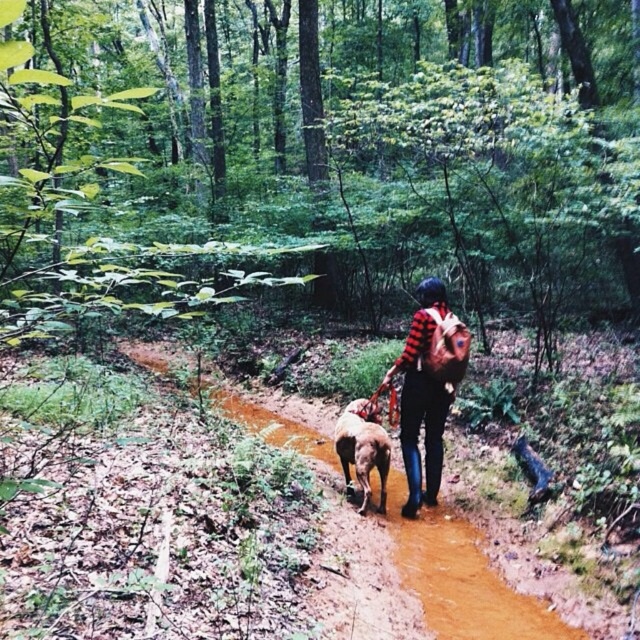
Question: Does brown dirt trail at center appear over brown furry dog at center?

Choices:
 (A) no
 (B) yes

Answer: (A)

Question: Is brown dirt trail at center closer to the viewer compared to plaid shirt at center?

Choices:
 (A) no
 (B) yes

Answer: (B)

Question: Is brown dirt trail at center further to the viewer compared to plaid shirt at center?

Choices:
 (A) yes
 (B) no

Answer: (B)

Question: Which point appears closest to the camera in this image?

Choices:
 (A) (410, 461)
 (B) (362, 429)

Answer: (B)

Question: Which point appears closest to the camera in this image?

Choices:
 (A) (474, 634)
 (B) (355, 424)

Answer: (A)

Question: Which object appears closest to the camera in this image?

Choices:
 (A) plaid shirt at center
 (B) brown furry dog at center

Answer: (A)